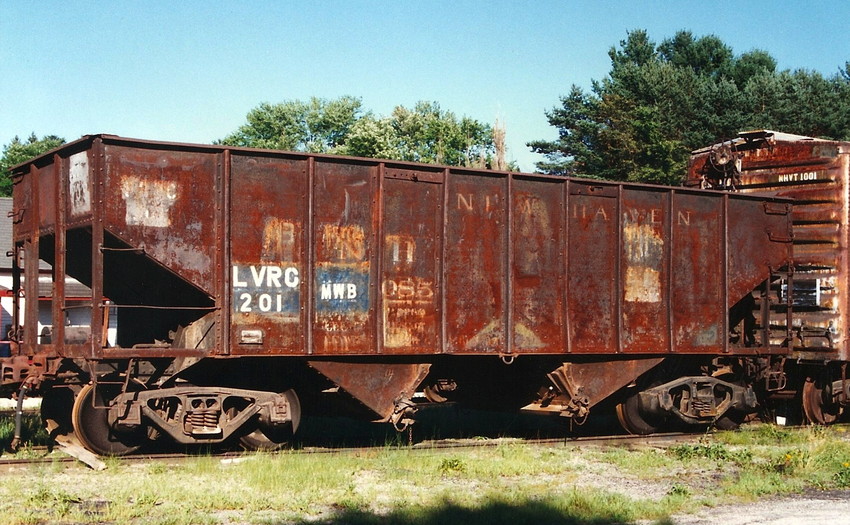
What are the coordinates of `ladder` in the screenshot? It's located at (777, 304), (777, 325).